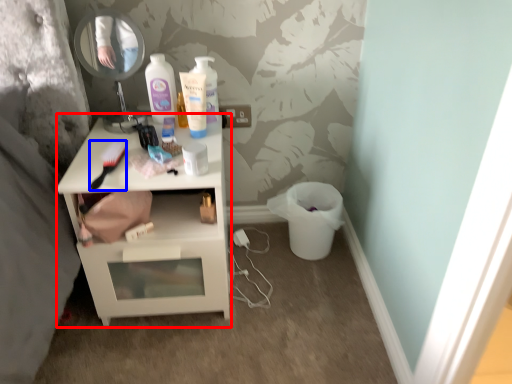
Question: Which of the following is the farthest to the observer, nightstand (highlighted by a red box) or brush (highlighted by a blue box)?

Choices:
 (A) nightstand
 (B) brush

Answer: (A)